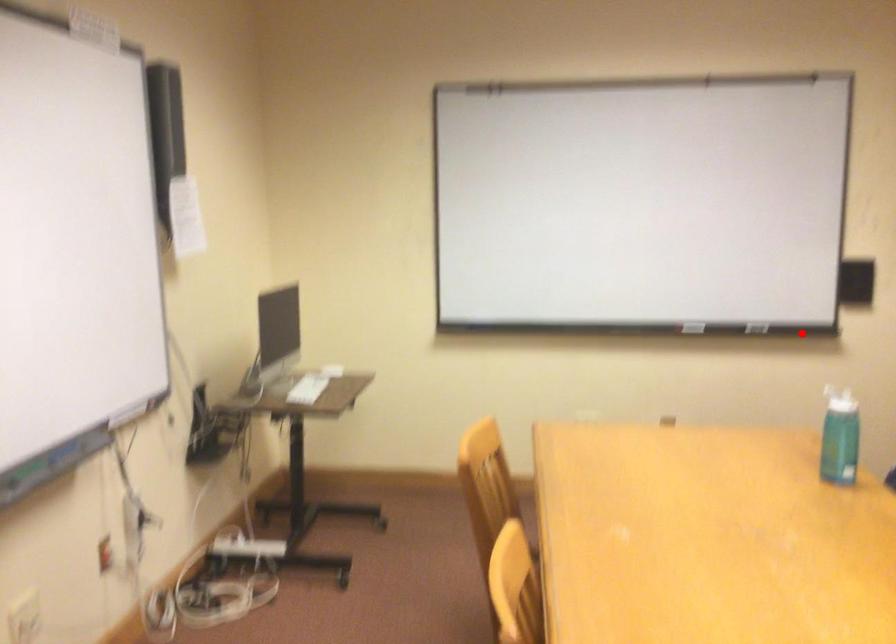
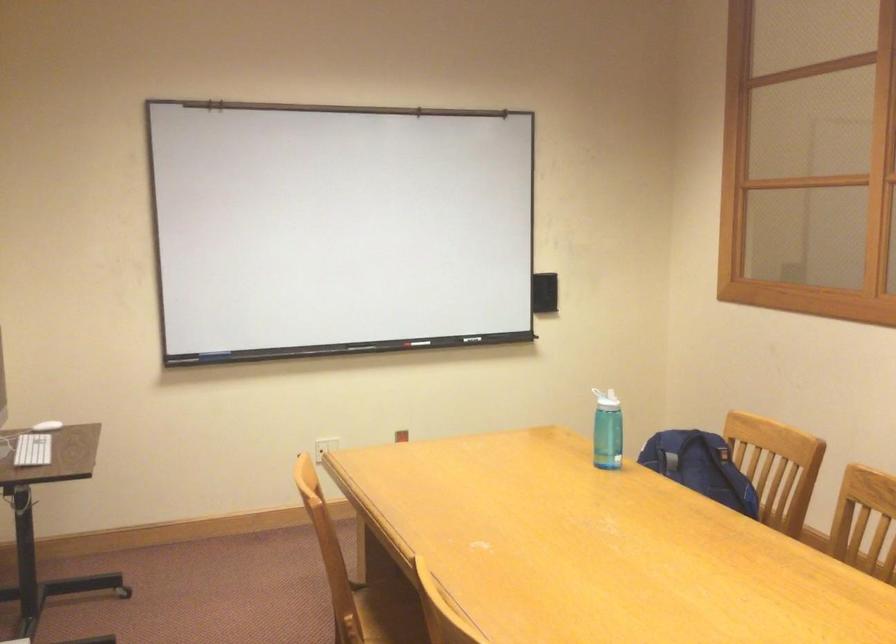
Find the pixel in the second image that matches the highlighted location in the first image.

(476, 339)